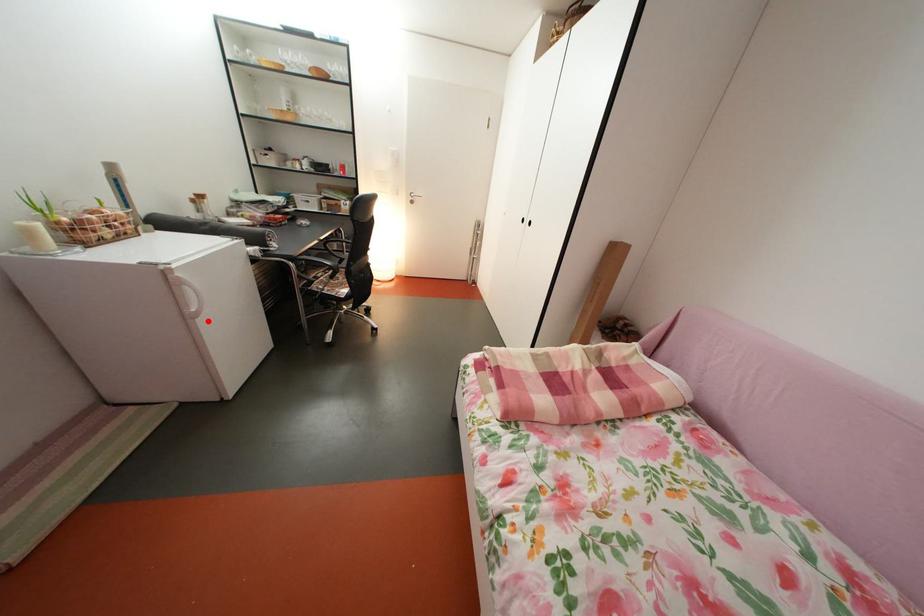
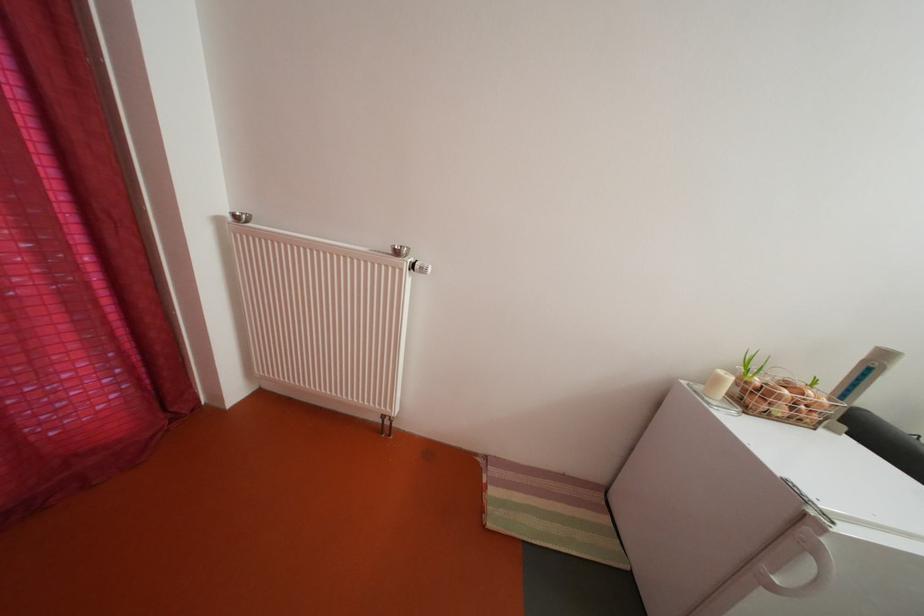
Question: I am providing you with two images of the same scene from different viewpoints. In image1, a red point is highlighted. Considering the same 3D point in image2, which of the following is correct?

Choices:
 (A) It is closer
 (B) It is farther

Answer: (A)